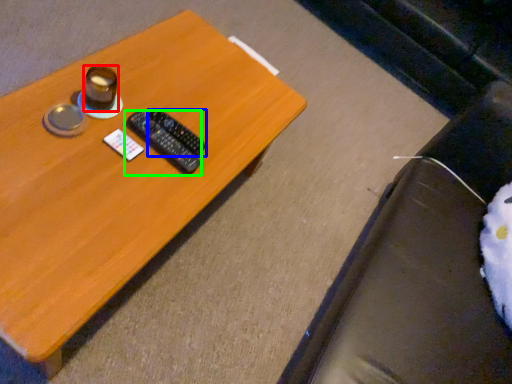
Question: Which is nearer to the coffee cup (highlighted by a red box)? remote control (highlighted by a blue box) or remote control (highlighted by a green box).

Choices:
 (A) remote control
 (B) remote control

Answer: (B)